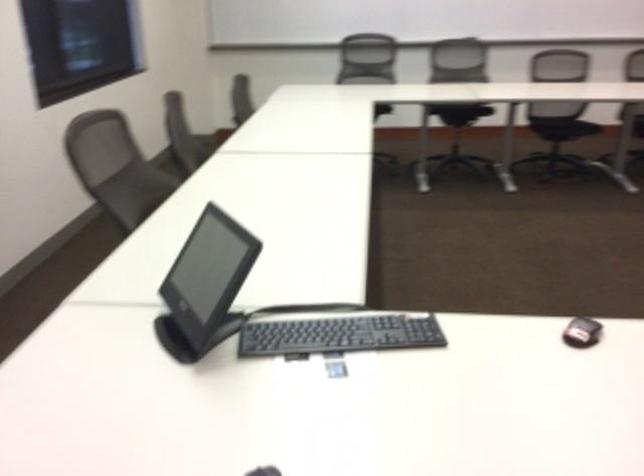
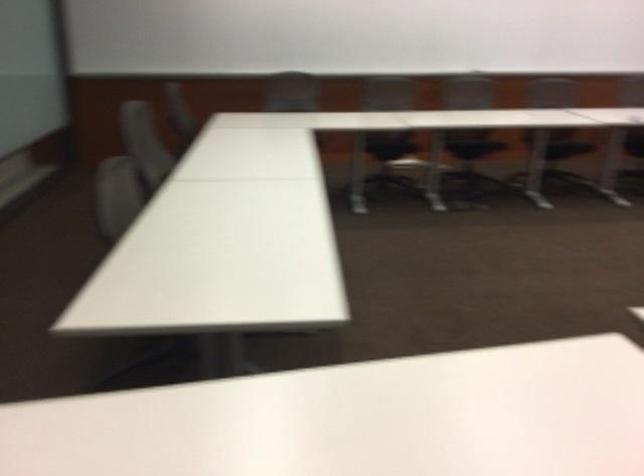
How did the camera likely rotate?

The camera rotated toward right-down.